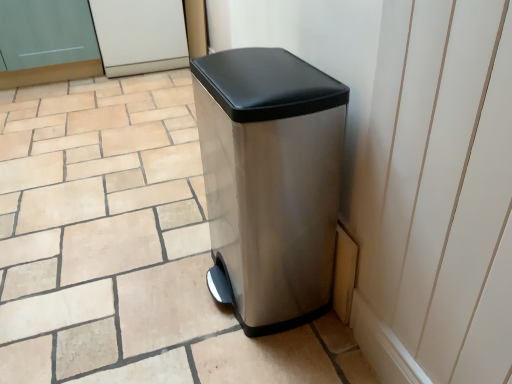
Question: From a real-world perspective, does stainless steel trash can at center sit lower than matte silver trash can at center?

Choices:
 (A) no
 (B) yes

Answer: (A)

Question: From the image's perspective, is stainless steel trash can at center over matte silver trash can at center?

Choices:
 (A) yes
 (B) no

Answer: (B)

Question: From a real-world perspective, does stainless steel trash can at center stand above matte silver trash can at center?

Choices:
 (A) no
 (B) yes

Answer: (B)

Question: Is stainless steel trash can at center thinner than matte silver trash can at center?

Choices:
 (A) no
 (B) yes

Answer: (B)

Question: Does stainless steel trash can at center lie in front of matte silver trash can at center?

Choices:
 (A) no
 (B) yes

Answer: (A)

Question: Is stainless steel trash can at center aimed at matte silver trash can at center?

Choices:
 (A) yes
 (B) no

Answer: (B)

Question: Is matte silver trash can at center in front of white glossy screen door at upper center, which ranks as the first screen door in right-to-left order?

Choices:
 (A) yes
 (B) no

Answer: (A)

Question: From a real-world perspective, is matte silver trash can at center located higher than white glossy screen door at upper center, which ranks as the first screen door in right-to-left order?

Choices:
 (A) yes
 (B) no

Answer: (B)

Question: Are matte silver trash can at center and white glossy screen door at upper center, which ranks as the first screen door in right-to-left order, far apart?

Choices:
 (A) no
 (B) yes

Answer: (B)

Question: Is matte silver trash can at center next to white glossy screen door at upper center, which ranks as the first screen door in right-to-left order, and touching it?

Choices:
 (A) no
 (B) yes

Answer: (A)

Question: Considering the relative positions of matte silver trash can at center and white glossy screen door at upper center, positioned as the second screen door in left-to-right order, in the image provided, is matte silver trash can at center to the left of white glossy screen door at upper center, positioned as the second screen door in left-to-right order, from the viewer's perspective?

Choices:
 (A) yes
 (B) no

Answer: (B)

Question: Is matte silver trash can at center positioned behind white glossy screen door at upper center, positioned as the second screen door in left-to-right order?

Choices:
 (A) yes
 (B) no

Answer: (B)

Question: Is white glossy screen door at upper center, which ranks as the first screen door in right-to-left order, facing away from stainless steel trash can at center?

Choices:
 (A) yes
 (B) no

Answer: (B)